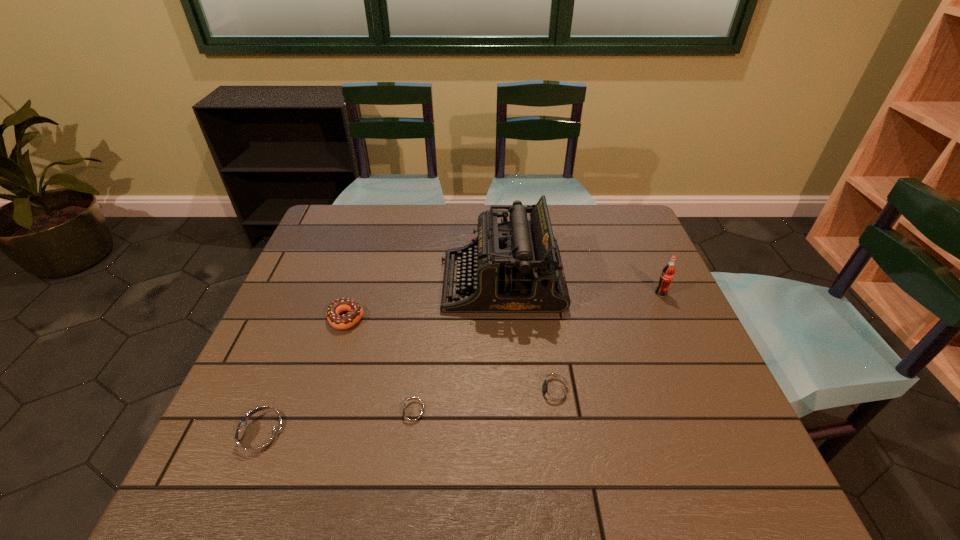
Where is `watch present at the left edge`? The height and width of the screenshot is (540, 960). watch present at the left edge is located at coordinates (260, 437).

You are a GUI agent. You are given a task and a screenshot of the screen. Output one action in this format:
    pyautogui.click(x=<x>, y=<y>)
    Task: Click on the doughnut positioned at the left edge
    
    Given the screenshot: What is the action you would take?
    pyautogui.click(x=355, y=313)

This screenshot has height=540, width=960. I want to click on object that is at the right edge, so click(x=668, y=272).

Find the location of `object positioned at the near left corner`. object positioned at the near left corner is located at coordinates (260, 437).

Where is `free space at the far edge`? This screenshot has height=540, width=960. free space at the far edge is located at coordinates (421, 237).

This screenshot has width=960, height=540. Identify the location of free location at the near edge of the desktop. (531, 442).

At what (x,y) coordinates should I click in order to perform the action: click on vacant space at the left edge of the desktop. Please return your answer as a coordinate pair (x, y). Looking at the image, I should click on (332, 302).

Image resolution: width=960 pixels, height=540 pixels. In the image, there is a desktop. Find the location of `vacant space at the right edge`. vacant space at the right edge is located at coordinates (642, 325).

Where is `vacant area at the far left corner`? The height and width of the screenshot is (540, 960). vacant area at the far left corner is located at coordinates [352, 204].

This screenshot has height=540, width=960. In order to click on free space at the far right corner of the desktop in this screenshot , I will do (643, 236).